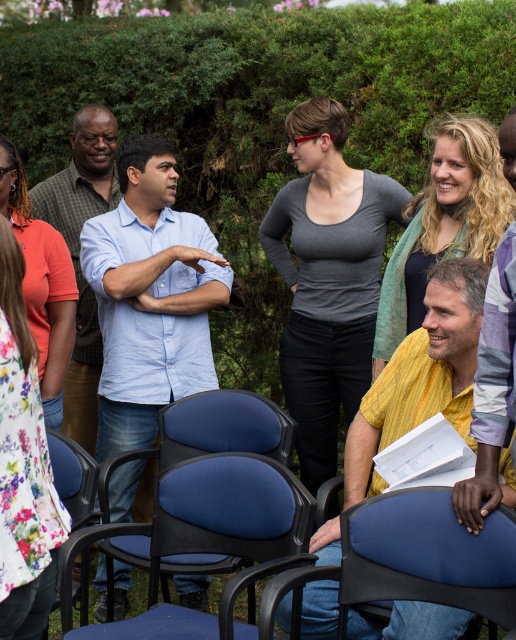
You are a photographer standing at the edge of the park. You want to capture a photo where both the light blue shirt at center and the blue fabric chair at lower left are in focus. Given that your camera has a depth of field that can sharply focus on objects within 1.5 meters of each other, will both subjects be in focus?

The light blue shirt at center and blue fabric chair at lower left are 1.49 meters apart from each other, which is within the 1.5 meters depth of field. Therefore, both subjects will be in focus.

You are a photographer trying to capture a photo of the gray matte shirt at center and the blue fabric chair at center. Since you want both subjects to be in focus, you need to adjust your camera settings based on their sizes. Which subject should you focus on first to ensure proper depth of field?

The gray matte shirt at center is much taller than the blue fabric chair at center, so you should focus on the gray matte shirt at center first to ensure both are in focus.